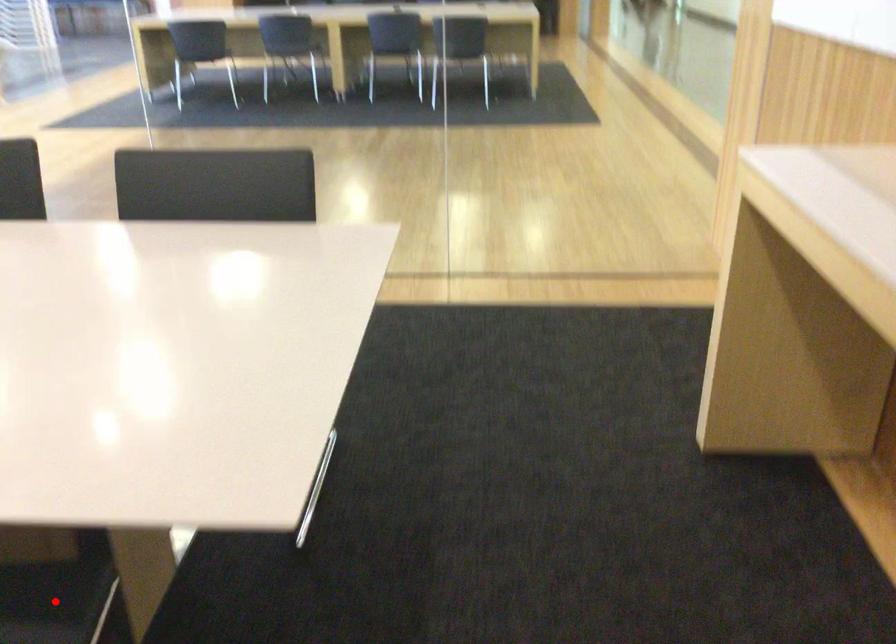
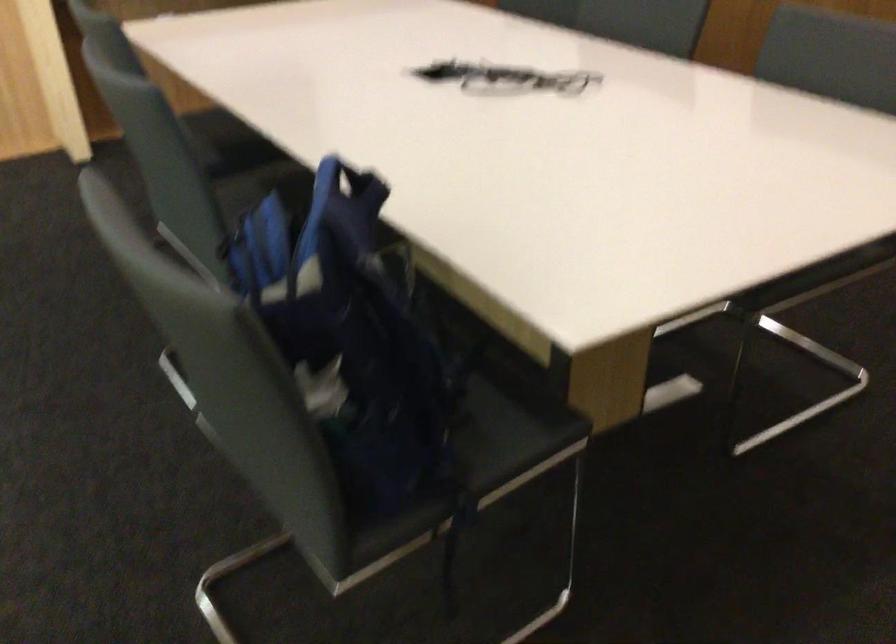
Question: I am providing you with two images of the same scene from different viewpoints. A red point is marked on the first image. Can you still see the location of the red point in image 2?

Choices:
 (A) Yes
 (B) No

Answer: (B)